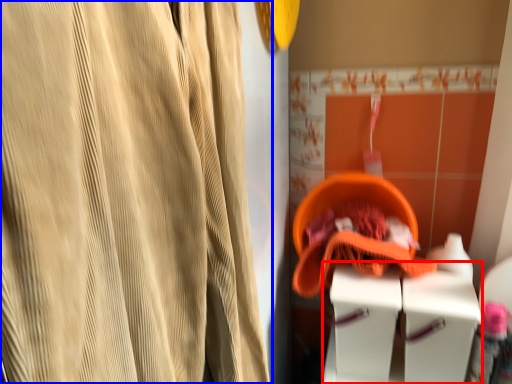
Question: Among these objects, which one is farthest to the camera, vanity (highlighted by a red box) or curtain (highlighted by a blue box)?

Choices:
 (A) vanity
 (B) curtain

Answer: (A)